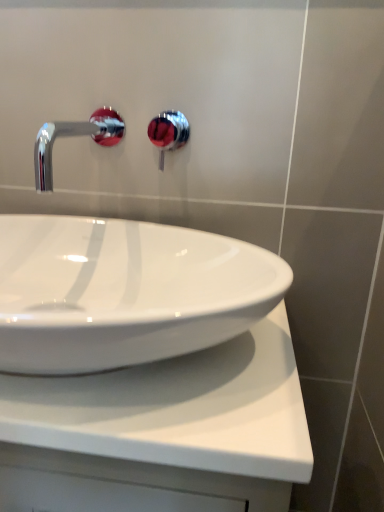
Question: Can you confirm if white glossy countertop at center is taller than chrome/metallic faucet at upper left?

Choices:
 (A) yes
 (B) no

Answer: (A)

Question: Is white glossy countertop at center outside of chrome/metallic faucet at upper left?

Choices:
 (A) no
 (B) yes

Answer: (B)

Question: From a real-world perspective, is white glossy countertop at center positioned under chrome/metallic faucet at upper left based on gravity?

Choices:
 (A) yes
 (B) no

Answer: (A)

Question: Considering the relative sizes of white glossy countertop at center and chrome/metallic faucet at upper left in the image provided, is white glossy countertop at center thinner than chrome/metallic faucet at upper left?

Choices:
 (A) no
 (B) yes

Answer: (A)

Question: Can you confirm if white glossy countertop at center is wider than chrome/metallic faucet at upper left?

Choices:
 (A) yes
 (B) no

Answer: (A)

Question: Could you tell me if white glossy countertop at center is turned towards chrome/metallic faucet at upper left?

Choices:
 (A) yes
 (B) no

Answer: (B)

Question: Considering the relative sizes of chrome/red faucet at upper center and chrome/metallic faucet at upper left in the image provided, is chrome/red faucet at upper center bigger than chrome/metallic faucet at upper left?

Choices:
 (A) no
 (B) yes

Answer: (A)

Question: Is chrome/metallic faucet at upper left completely or partially inside chrome/red faucet at upper center?

Choices:
 (A) no
 (B) yes

Answer: (A)

Question: Considering the relative positions of chrome/red faucet at upper center and chrome/metallic faucet at upper left in the image provided, is chrome/red faucet at upper center to the right of chrome/metallic faucet at upper left from the viewer's perspective?

Choices:
 (A) yes
 (B) no

Answer: (A)

Question: Is chrome/red faucet at upper center located outside chrome/metallic faucet at upper left?

Choices:
 (A) yes
 (B) no

Answer: (A)

Question: Does chrome/red faucet at upper center have a greater height compared to chrome/metallic faucet at upper left?

Choices:
 (A) no
 (B) yes

Answer: (B)

Question: Is chrome/red faucet at upper center facing towards chrome/metallic faucet at upper left?

Choices:
 (A) yes
 (B) no

Answer: (B)

Question: Is chrome/red faucet at upper center aimed at white glossy countertop at center?

Choices:
 (A) yes
 (B) no

Answer: (B)